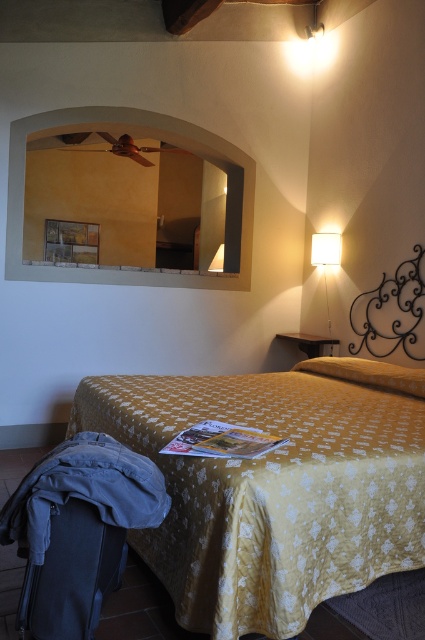
Between yellow floral fabric bed at lower left and matte black suitcase at lower left, which one appears on the right side from the viewer's perspective?

From the viewer's perspective, yellow floral fabric bed at lower left appears more on the right side.

Is point (308, 451) more distant than point (74, 556)?

Yes, point (308, 451) is behind point (74, 556).

Identify the location of yellow floral fabric bed at lower left. (271, 492).

Is yellow floral fabric bed at lower left smaller than yellow fabric pillow at upper right?

No.

What do you see at coordinates (271, 492) in the screenshot? I see `yellow floral fabric bed at lower left` at bounding box center [271, 492].

In order to click on yellow floral fabric bed at lower left in this screenshot , I will do `click(271, 492)`.

Is matte black suitcase at lower left wider than yellow fabric pillow at upper right?

No, matte black suitcase at lower left is not wider than yellow fabric pillow at upper right.

Does point (90, 577) come farther from viewer compared to point (357, 369)?

No, (90, 577) is closer to viewer.

Describe the element at coordinates (71, 573) in the screenshot. I see `matte black suitcase at lower left` at that location.

This screenshot has width=425, height=640. Identify the location of matte black suitcase at lower left. (71, 573).